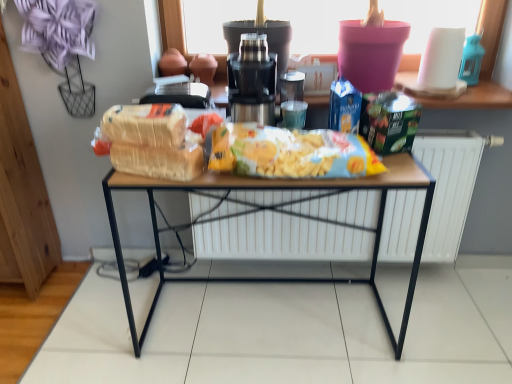
Question: Does yellow matte chips at center have a greater height compared to translucent plastic bag of cereal at center?

Choices:
 (A) no
 (B) yes

Answer: (B)

Question: Is yellow matte chips at center bigger than translucent plastic bag of cereal at center?

Choices:
 (A) no
 (B) yes

Answer: (B)

Question: Is yellow matte chips at center not close to translucent plastic bag of cereal at center?

Choices:
 (A) yes
 (B) no

Answer: (B)

Question: Is yellow matte chips at center facing towards translucent plastic bag of cereal at center?

Choices:
 (A) no
 (B) yes

Answer: (A)

Question: Is yellow matte chips at center facing away from translucent plastic bag of cereal at center?

Choices:
 (A) yes
 (B) no

Answer: (B)

Question: Can you confirm if yellow matte chips at center is shorter than translucent plastic bag of cereal at center?

Choices:
 (A) no
 (B) yes

Answer: (A)

Question: Does metallic silver coffee machine at center have a lesser width compared to yellow matte chips at center?

Choices:
 (A) yes
 (B) no

Answer: (B)

Question: From the image's perspective, is metallic silver coffee machine at center beneath yellow matte chips at center?

Choices:
 (A) yes
 (B) no

Answer: (B)

Question: From the image's perspective, is metallic silver coffee machine at center above yellow matte chips at center?

Choices:
 (A) yes
 (B) no

Answer: (A)

Question: Is metallic silver coffee machine at center at the left side of yellow matte chips at center?

Choices:
 (A) no
 (B) yes

Answer: (B)

Question: Is metallic silver coffee machine at center positioned beyond the bounds of yellow matte chips at center?

Choices:
 (A) yes
 (B) no

Answer: (A)

Question: Considering the relative positions of metallic silver coffee machine at center and yellow matte chips at center in the image provided, is metallic silver coffee machine at center in front of yellow matte chips at center?

Choices:
 (A) yes
 (B) no

Answer: (B)

Question: Considering the relative sizes of metallic silver coffee machine at center and bread at center in the image provided, is metallic silver coffee machine at center smaller than bread at center?

Choices:
 (A) yes
 (B) no

Answer: (B)